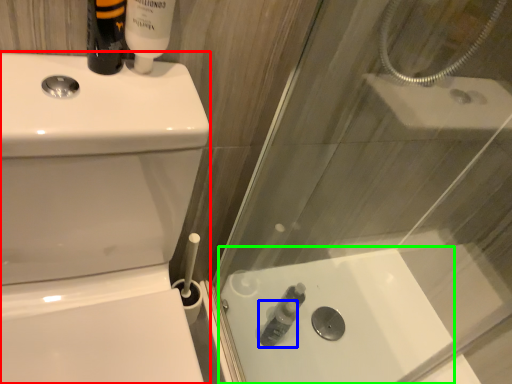
Question: Which object is positioned closest to toilet bowl (highlighted by a red box)? Select from toiletry (highlighted by a blue box) and bath (highlighted by a green box).

Choices:
 (A) toiletry
 (B) bath

Answer: (B)